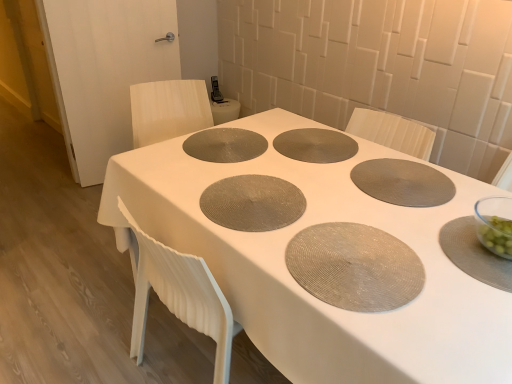
Where is `vacant space in between matte gray placemat at center, acting as the first pizza pan starting from the left, and matte gray placemat at center, positioned as the second pizza pan in right-to-left order`? This screenshot has height=384, width=512. vacant space in between matte gray placemat at center, acting as the first pizza pan starting from the left, and matte gray placemat at center, positioned as the second pizza pan in right-to-left order is located at coordinates [x=279, y=164].